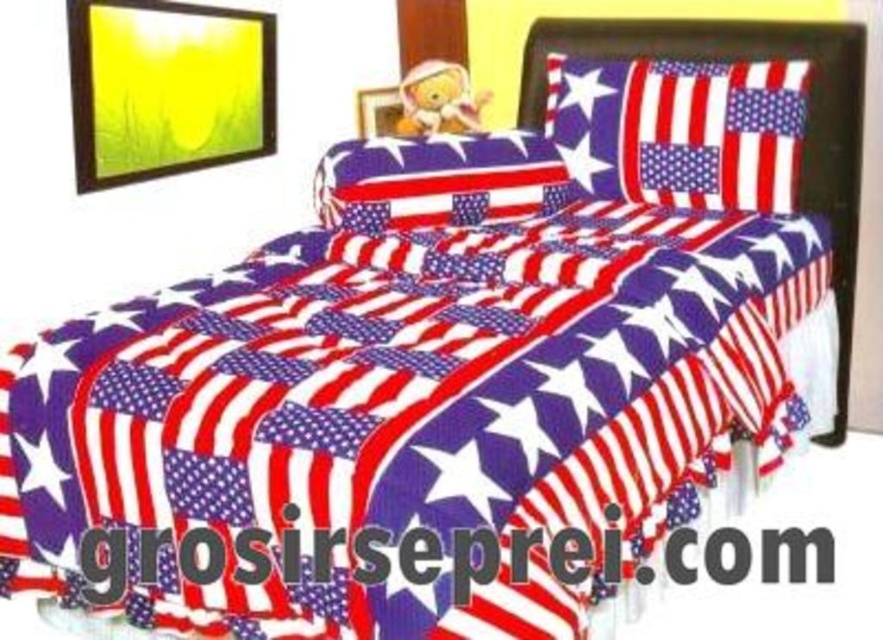
Which is more to the left, wooden picture frame at upper left or metallic gold picture frame at upper center?

Positioned to the left is wooden picture frame at upper left.

Can you confirm if wooden picture frame at upper left is wider than metallic gold picture frame at upper center?

Yes, wooden picture frame at upper left is wider than metallic gold picture frame at upper center.

Find the location of a particular element. wooden picture frame at upper left is located at coordinates (167, 88).

Where is `wooden picture frame at upper left`? This screenshot has width=883, height=640. wooden picture frame at upper left is located at coordinates (167, 88).

Does american flag fabric at upper right appear on the right side of metallic gold picture frame at upper center?

Yes, american flag fabric at upper right is to the right of metallic gold picture frame at upper center.

Is american flag fabric at upper right further to the viewer compared to metallic gold picture frame at upper center?

No.

This screenshot has width=883, height=640. Describe the element at coordinates (680, 129) in the screenshot. I see `american flag fabric at upper right` at that location.

Find the location of a particular element. american flag fabric at upper right is located at coordinates (680, 129).

In the scene shown: Does american flag fabric at upper right have a larger size compared to american flag fabric pillow at center?

Correct, american flag fabric at upper right is larger in size than american flag fabric pillow at center.

Measure the distance from american flag fabric at upper right to american flag fabric pillow at center.

american flag fabric at upper right is 45.94 centimeters from american flag fabric pillow at center.

You are a GUI agent. You are given a task and a screenshot of the screen. Output one action in this format:
    pyautogui.click(x=<x>, y=<y>)
    Task: Click on the american flag fabric at upper right
    Image resolution: width=883 pixels, height=640 pixels.
    Given the screenshot: What is the action you would take?
    pyautogui.click(x=680, y=129)